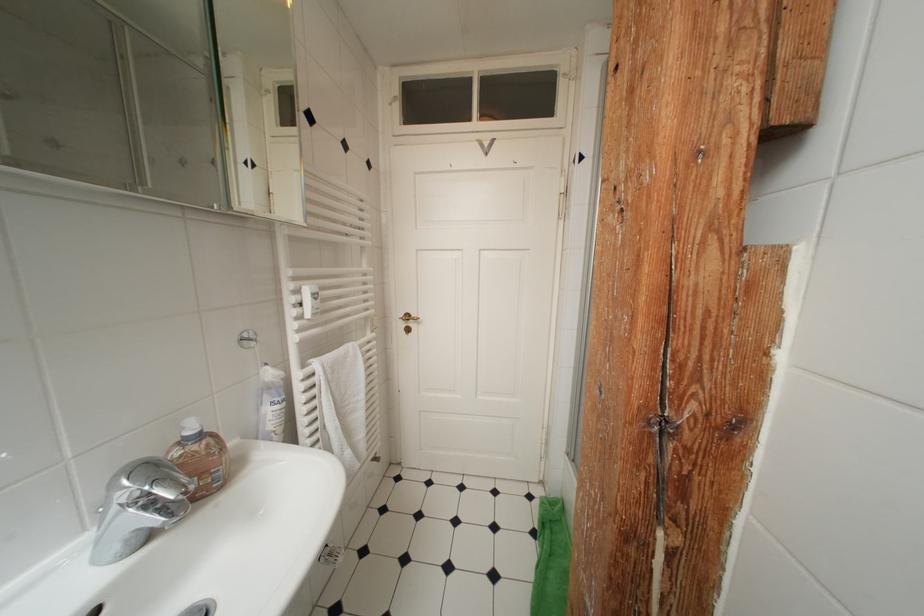
Locate an element on the screen. soap dispenser pump is located at coordinates (271, 403).